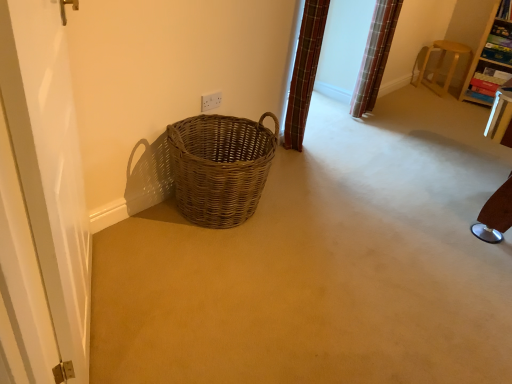
Image resolution: width=512 pixels, height=384 pixels. What are the coordinates of `vacant space in between white glossy screen door at left and wooden bookshelf at upper right, which is the second furniture in left-to-right order` in the screenshot? It's located at (336, 177).